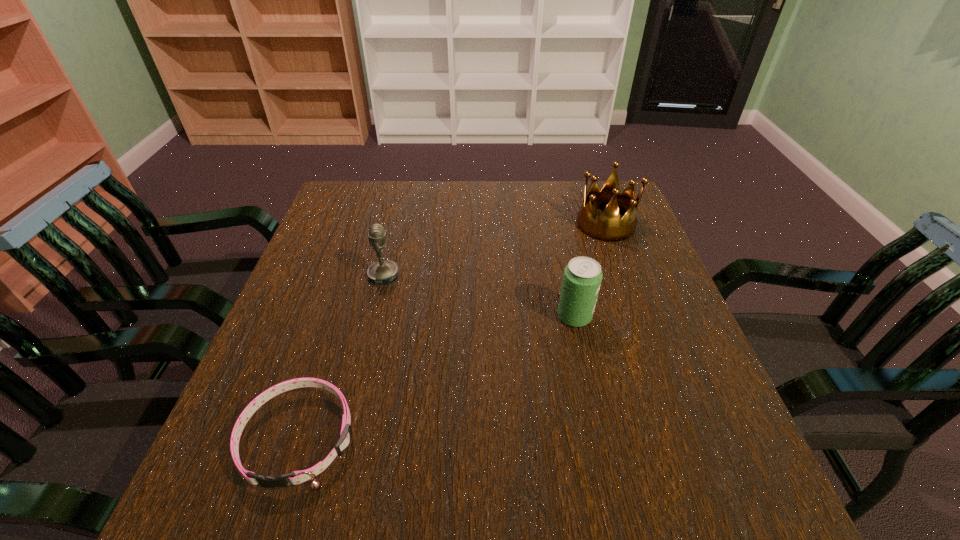
Image resolution: width=960 pixels, height=540 pixels. I want to click on free location at the near left corner, so click(x=205, y=476).

In the image, there is a desktop. Identify the location of vacant region at the near right corner. (762, 489).

Locate an element on the screen. free space between the microphone and the farthest object is located at coordinates pyautogui.click(x=494, y=250).

In order to click on vacant space that's between the second farthest object and the nearest object in this screenshot , I will do `click(342, 357)`.

Where is `vacant area between the crown and the shortest object`? Image resolution: width=960 pixels, height=540 pixels. vacant area between the crown and the shortest object is located at coordinates (452, 331).

This screenshot has height=540, width=960. In order to click on free point between the second object from right to left and the third nearest object in this screenshot , I will do `click(479, 296)`.

Identify the location of free spot between the second farthest object and the dog collar. coord(342,357).

The width and height of the screenshot is (960, 540). What are the coordinates of `vacant area between the farthest object and the dog collar` in the screenshot? It's located at (452, 331).

Where is `vacant space in between the second object from right to left and the dog collar`? The image size is (960, 540). vacant space in between the second object from right to left and the dog collar is located at coordinates (437, 377).

In order to click on free space that is in between the second object from right to left and the third nearest object in this screenshot , I will do `click(479, 296)`.